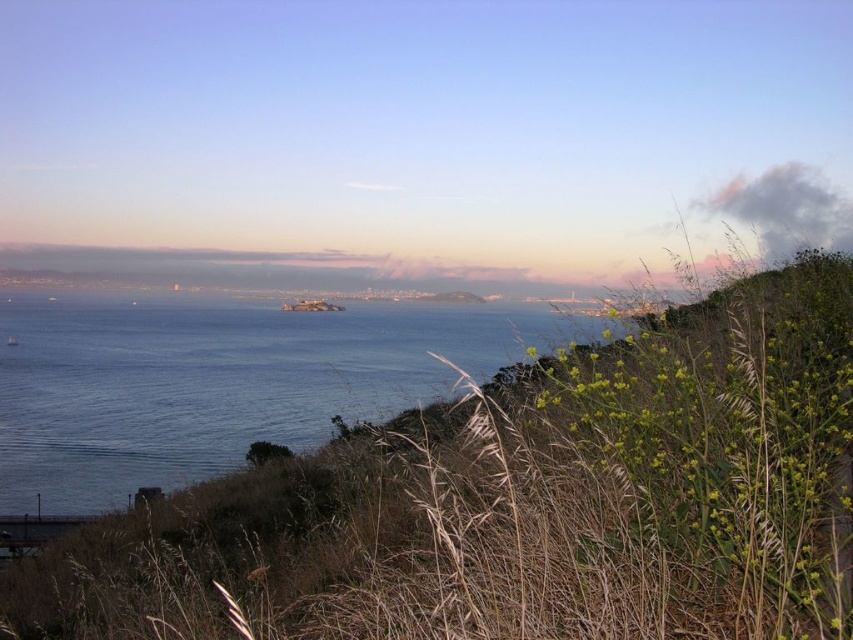
Does green dry grass at lower right have a smaller size compared to blue water at center?

Correct, green dry grass at lower right occupies less space than blue water at center.

Is point (76, 634) positioned before point (393, 314)?

Yes, it is in front of point (393, 314).

Locate an element on the screen. green dry grass at lower right is located at coordinates (521, 500).